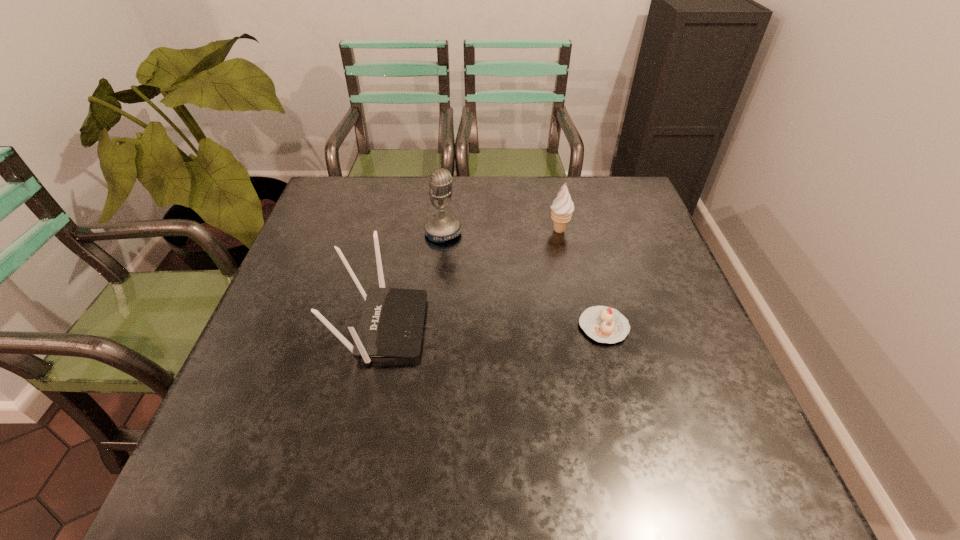
You are a GUI agent. You are given a task and a screenshot of the screen. Output one action in this format:
    pyautogui.click(x=<x>, y=<y>)
    Task: Click on the vacant space on the desktop that is between the router and the cupcake and is positioned on the front-facing side of the tallest object
    
    Given the screenshot: What is the action you would take?
    pyautogui.click(x=525, y=327)

I want to click on free space on the desktop that is between the router and the cupcake and is positioned on the front-facing side of the icecream, so click(491, 327).